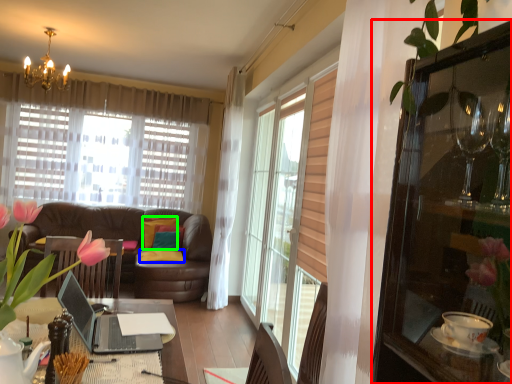
Question: Which object is the closest to the cabinetry (highlighted by a red box)? Choose among these: pillow (highlighted by a blue box) or pillow (highlighted by a green box).

Choices:
 (A) pillow
 (B) pillow

Answer: (A)